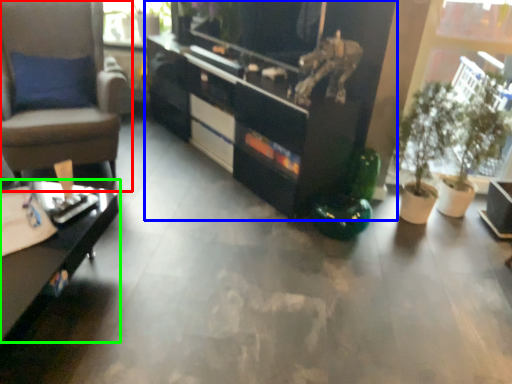
Question: Which is farther away from chair (highlighted by a red box)? cabinetry (highlighted by a blue box) or desk (highlighted by a green box)?

Choices:
 (A) cabinetry
 (B) desk

Answer: (A)